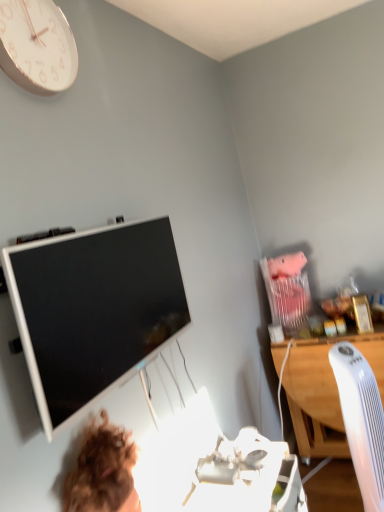
Question: Considering the positions of white plastic computer chair at right and white wood desk at right in the image, is white plastic computer chair at right taller or shorter than white wood desk at right?

Choices:
 (A) short
 (B) tall

Answer: (B)

Question: In terms of size, does white plastic computer chair at right appear bigger or smaller than white wood desk at right?

Choices:
 (A) big
 (B) small

Answer: (B)

Question: Considering the real-world distances, which object is farthest from the white glossy television at upper left?

Choices:
 (A) white plastic computer chair at right
 (B) white wood desk at right
 (C) white glossy clock at upper left

Answer: (B)

Question: Which object is the closest to the white glossy television at upper left?

Choices:
 (A) white wood desk at right
 (B) white glossy clock at upper left
 (C) white plastic computer chair at right

Answer: (B)